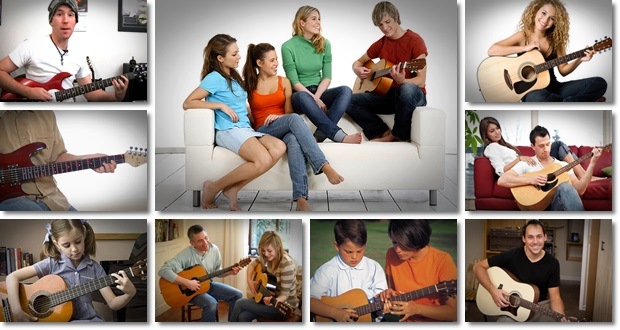
Image resolution: width=620 pixels, height=330 pixels. I want to click on photographs, so click(79, 60), click(250, 26), click(507, 31), click(511, 142), click(111, 172), click(113, 240), click(237, 241), click(386, 257), click(565, 266).